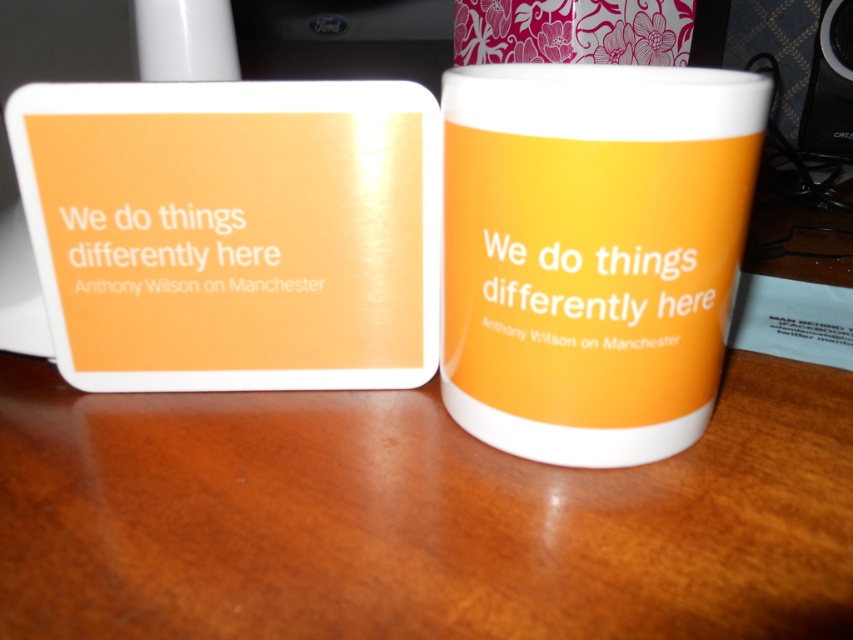
Question: Which of the following is the farthest from the observer?

Choices:
 (A) matte ceramic mug at center
 (B) black plastic speaker at upper right

Answer: (B)

Question: Does matte ceramic mug at center appear on the left side of black plastic speaker at upper right?

Choices:
 (A) no
 (B) yes

Answer: (B)

Question: Which point is closer to the camera?

Choices:
 (A) matte ceramic mug at center
 (B) black plastic speaker at upper right

Answer: (A)

Question: Which of the following is the closest to the observer?

Choices:
 (A) (608, 131)
 (B) (827, 3)

Answer: (A)

Question: Can you confirm if matte ceramic mug at center is wider than black plastic speaker at upper right?

Choices:
 (A) no
 (B) yes

Answer: (B)

Question: Does matte ceramic mug at center appear under black plastic speaker at upper right?

Choices:
 (A) no
 (B) yes

Answer: (B)